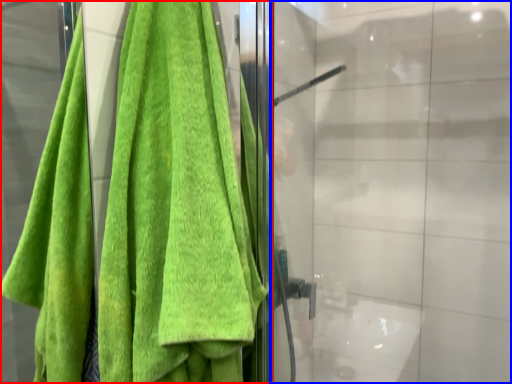
Question: Which object is further to the camera taking this photo, towel (highlighted by a red box) or glass door (highlighted by a blue box)?

Choices:
 (A) towel
 (B) glass door

Answer: (B)